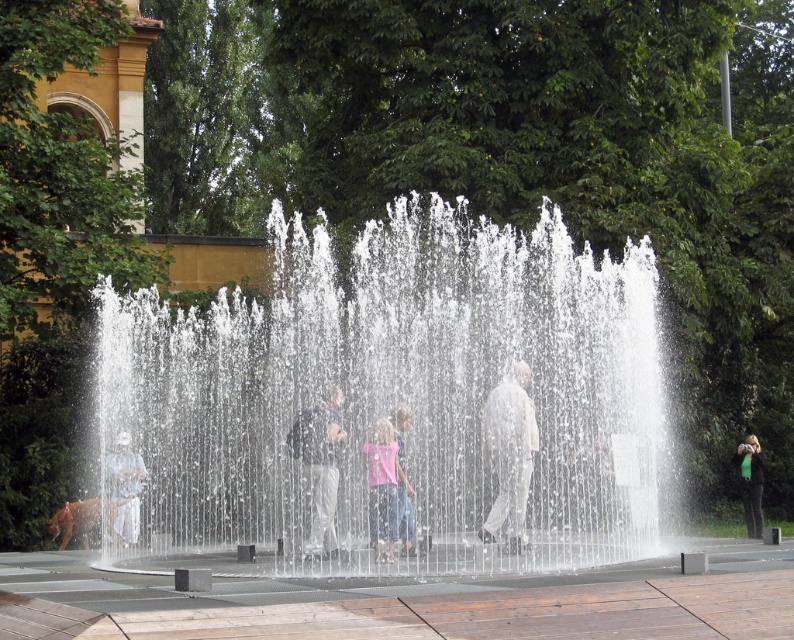
You are a photographer standing at the edge of the fountain plaza. You want to capture a photo of the light blue jeans at center and the green fabric bag at right in the same frame. Considering their heights, which object will appear larger in the photo?

The light blue jeans at center will appear larger in the photo because it is much taller than the green fabric bag at right.

You are standing at the edge of the fountain and see the light blue jeans at center and the green fabric bag at right. Which object is closer to your left side?

A: The light blue jeans at center is closer to your left side since it is positioned to the left of the green fabric bag at right.